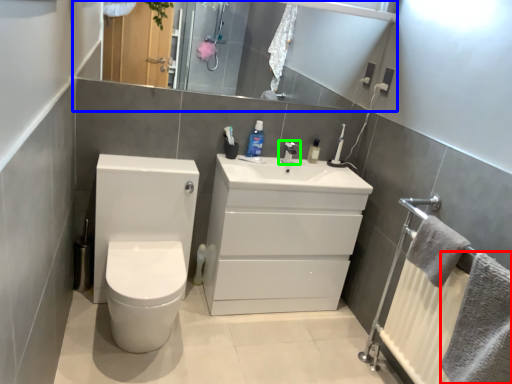
Question: Based on their relative distances, which object is nearer to bath towel (highlighted by a red box)? Choose from mirror (highlighted by a blue box) and tap (highlighted by a green box).

Choices:
 (A) mirror
 (B) tap

Answer: (B)